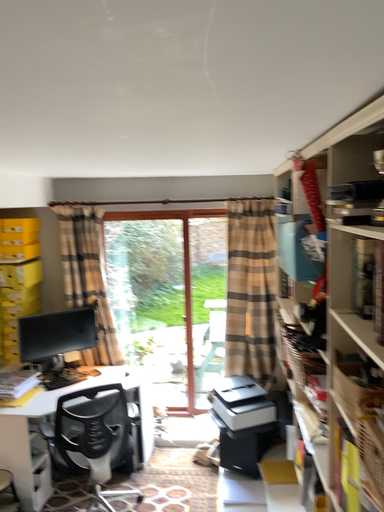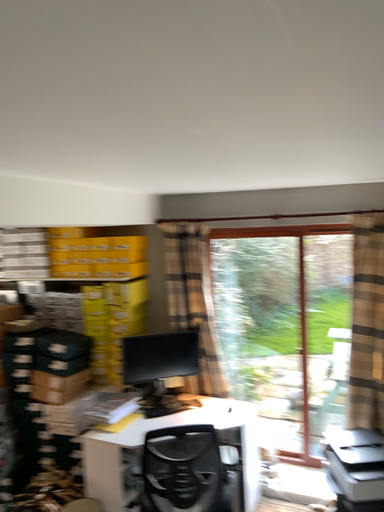
Question: Which way did the camera rotate in the video?

Choices:
 (A) rotated left
 (B) rotated right

Answer: (A)